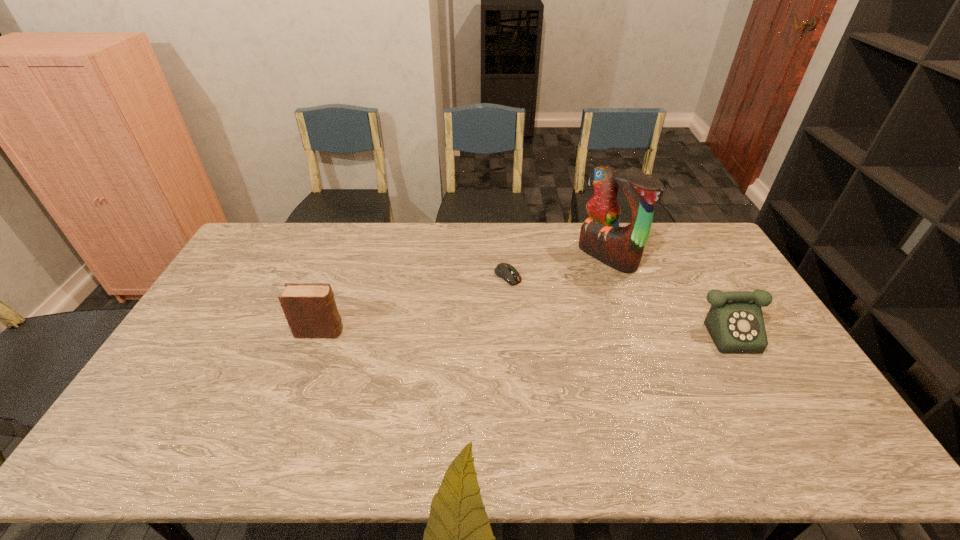
The height and width of the screenshot is (540, 960). What are the coordinates of `vacant space on the desktop that is between the diary and the rightmost object and is positioned on the button of the computer equipment` in the screenshot? It's located at (567, 330).

Identify the location of free space on the desktop that is between the leftmost object and the rightmost object and is positioned at the face of the second object from right to left. pyautogui.click(x=482, y=331).